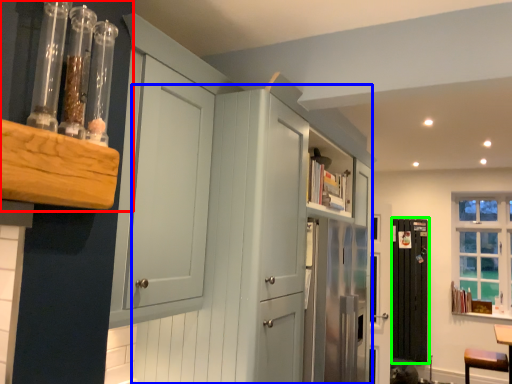
Question: Considering the real-world distances, which object is farthest from shelf (highlighted by a red box)? dresser (highlighted by a blue box) or screen door (highlighted by a green box)?

Choices:
 (A) dresser
 (B) screen door

Answer: (B)